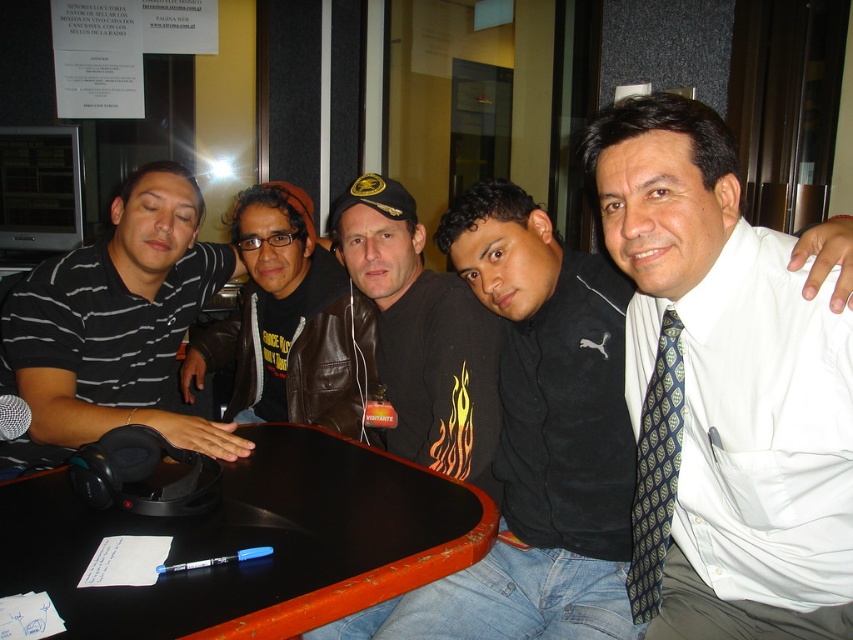
Between point (16, 572) and point (668, 406), which one is positioned behind?

The point (668, 406) is behind.

Can you confirm if black plastic round table at center is shorter than blue silk tie at right?

Correct, black plastic round table at center is not as tall as blue silk tie at right.

Where is `black plastic round table at center`? black plastic round table at center is located at coordinates (252, 541).

Who is positioned more to the right, black striped polo shirt at left or blue silk tie at right?

Positioned to the right is blue silk tie at right.

Find the location of a particular element. This screenshot has height=640, width=853. black striped polo shirt at left is located at coordinates (114, 326).

Measure the distance between black striped polo shirt at left and black leather jacket at center.

A distance of 19.53 inches exists between black striped polo shirt at left and black leather jacket at center.

Who is more distant from viewer, [155,365] or [352,621]?

The point [155,365] is more distant.

Locate an element on the screen. Image resolution: width=853 pixels, height=640 pixels. black striped polo shirt at left is located at coordinates (114, 326).